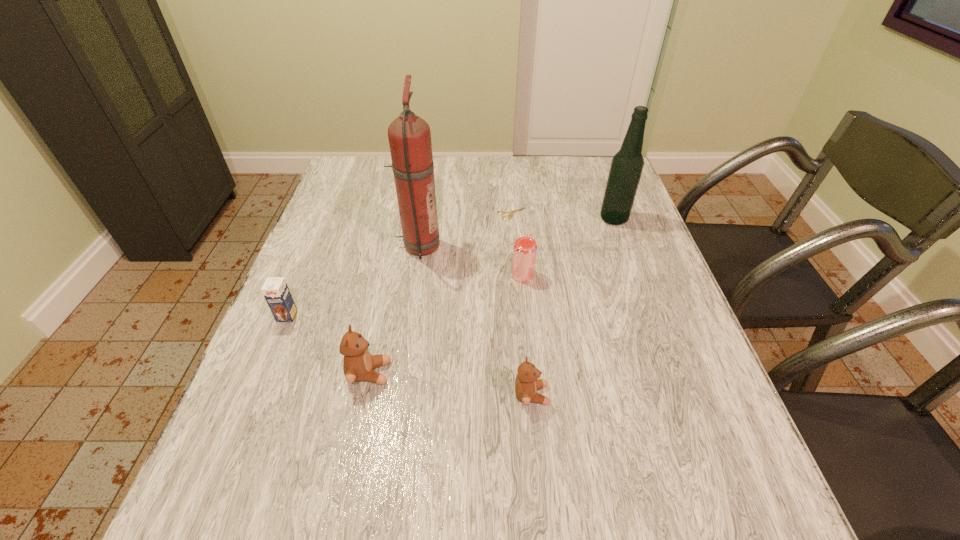
The height and width of the screenshot is (540, 960). In order to click on free region located on the front-facing side of the left teddy bear in this screenshot , I will do (455, 373).

I want to click on free space located 0.100m on the front-facing side of the shorter teddy bear, so click(601, 395).

Find the location of `vacant space located 0.080m on the front label of the third nearest object`. vacant space located 0.080m on the front label of the third nearest object is located at coordinates (273, 352).

This screenshot has height=540, width=960. What are the coordinates of `vacant space situated 0.280m on the left of the shears` in the screenshot? It's located at (399, 214).

I want to click on free space located on the front of the second tallest object, so click(x=637, y=284).

Locate an element on the screen. This screenshot has width=960, height=540. vacant space located 0.210m on the side of the third farthest object with the label and nozzle is located at coordinates (519, 246).

Identify the location of vacant area situated 0.230m on the front of the fourth nearest object. The height and width of the screenshot is (540, 960). (532, 362).

This screenshot has height=540, width=960. Find the location of `object situated at the near edge`. object situated at the near edge is located at coordinates (527, 384).

This screenshot has height=540, width=960. Identify the location of object that is positioned at the left edge. (275, 290).

I want to click on object located at the right edge, so click(x=627, y=164).